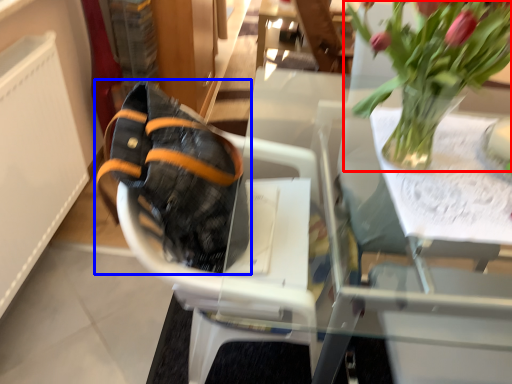
Question: Which of the following is the closest to the observer, houseplant (highlighted by a red box) or footwear (highlighted by a blue box)?

Choices:
 (A) houseplant
 (B) footwear

Answer: (A)